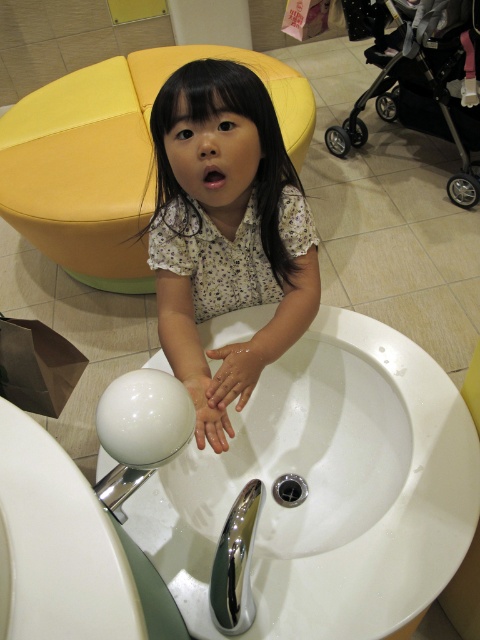
Can you confirm if white floral dress at center is thinner than chrome metallic faucet at sink center?

No, white floral dress at center is not thinner than chrome metallic faucet at sink center.

Is point (187, 262) farther from camera compared to point (228, 576)?

Yes, point (187, 262) is behind point (228, 576).

At what (x,y) coordinates should I click in order to perform the action: click on white floral dress at center. Please return your answer as a coordinate pair (x, y). Image resolution: width=480 pixels, height=640 pixels. Looking at the image, I should click on (226, 232).

Does metallic stroller at upper right have a smaller size compared to white matte hand at sink center?

Incorrect, metallic stroller at upper right is not smaller in size than white matte hand at sink center.

Which is below, metallic stroller at upper right or white matte hand at sink center?

Positioned lower is white matte hand at sink center.

Who is more distant from viewer, (450, 68) or (201, 404)?

Point (450, 68)

Find the location of `metallic stroller at upper right`. metallic stroller at upper right is located at coordinates (424, 86).

Can you confirm if white glossy sink at center is positioned below metallic stroller at upper right?

Yes.

Where is `white glossy sink at center`? white glossy sink at center is located at coordinates (327, 488).

Where is `white glossy sink at center`? The image size is (480, 640). white glossy sink at center is located at coordinates (327, 488).